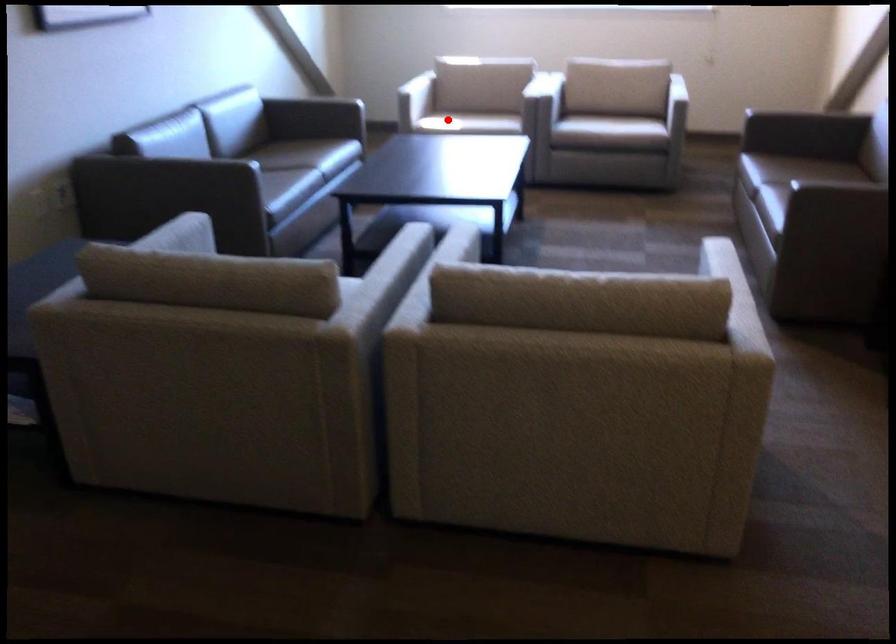
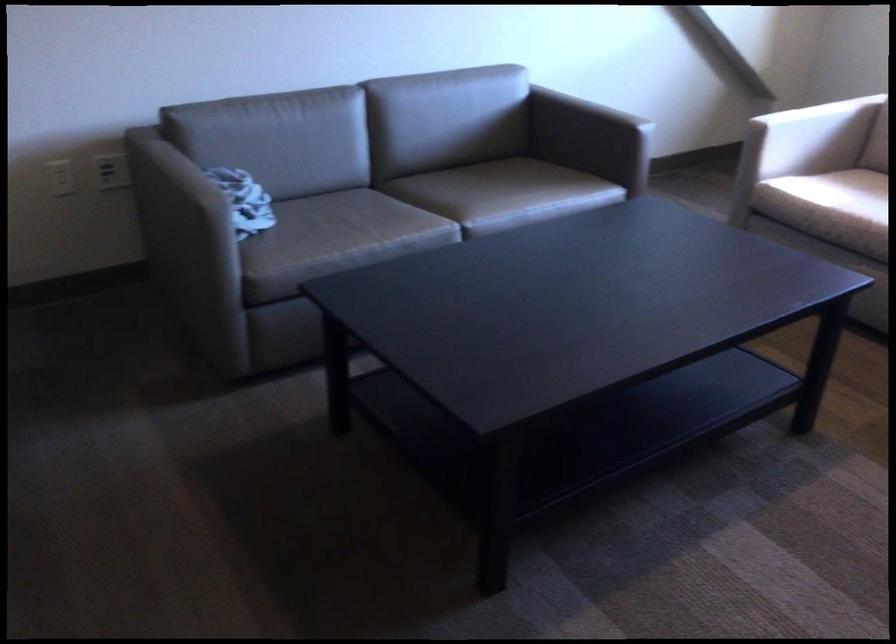
Where in the second image is the point corresponding to the highlighted location from the first image?

(821, 216)